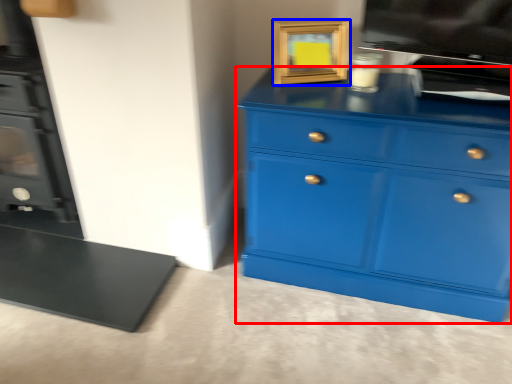
Question: Which point is closer to the camera, chest of drawers (highlighted by a red box) or picture frame (highlighted by a blue box)?

Choices:
 (A) chest of drawers
 (B) picture frame

Answer: (A)